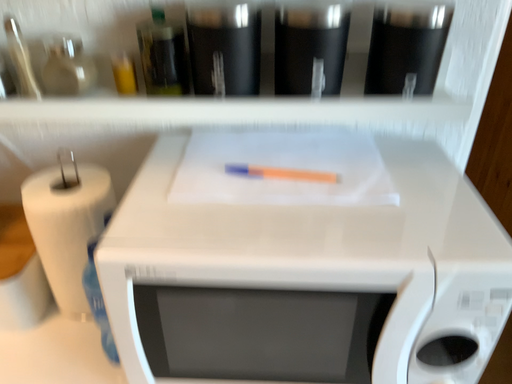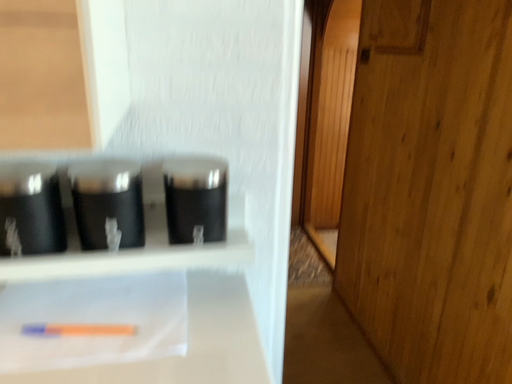
Question: Which way did the camera rotate in the video?

Choices:
 (A) rotated right
 (B) rotated left

Answer: (A)